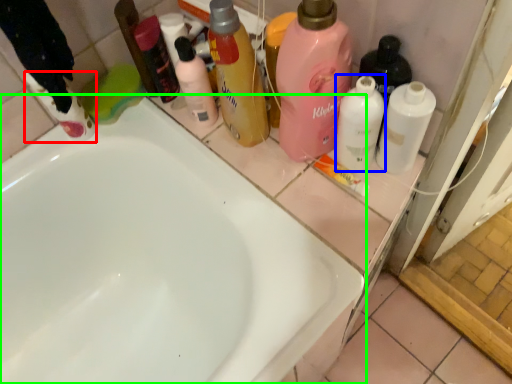
Question: Which object is positioned closest to cleaning product (highlighted by a red box)? Select from cleaning product (highlighted by a blue box) and bathtub (highlighted by a green box).

Choices:
 (A) cleaning product
 (B) bathtub

Answer: (B)